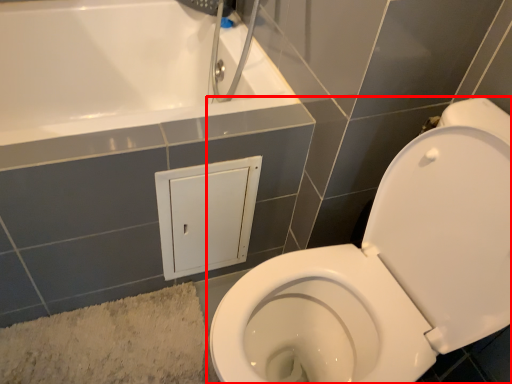
Question: From the image's perspective, what is the correct spatial positioning of toilet (annotated by the red box) in reference to bath mat?

Choices:
 (A) below
 (B) above

Answer: (B)